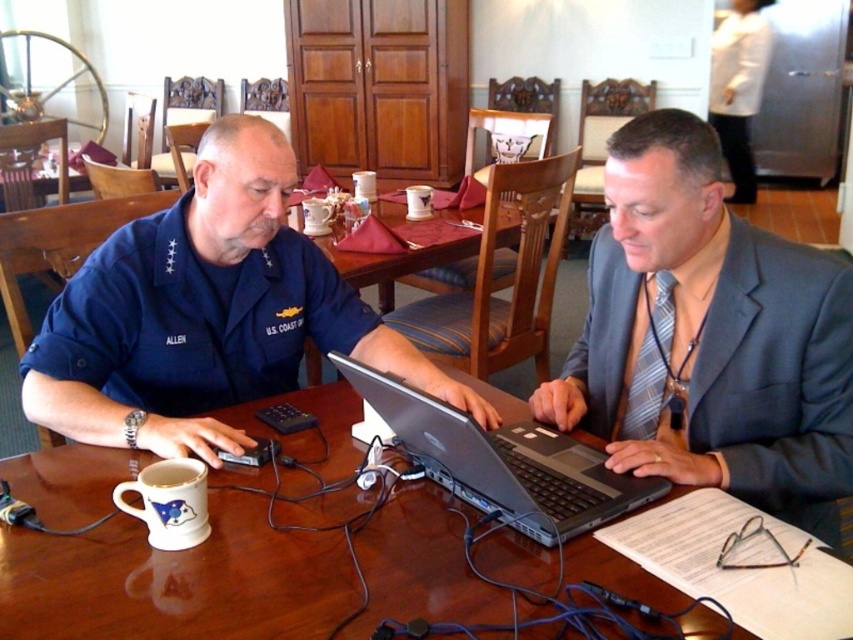
You are standing in the dining room and want to pick up the item at point (265, 506). If your arm can reach 3.5 feet, will you be able to reach it?

The point (265, 506) is 3.79 feet away from the viewer. Since your arm can only reach 3.5 feet, you will not be able to reach it.

You are standing in front of a dining table with a wooden surface. There is a point at coordinates point (3, 634). If you want to place a 12 inch long ruler on the table so that one end touches this point, where should the other end be placed to ensure the ruler is fully visible on the table?

The other end of the ruler should be placed 12 inches away from point (3, 634) in any direction that keeps the ruler entirely on the table surface.

You are a delivery robot that needs to place a package between the gray suit at center and the wooden table at center. The package requires 1 meter of space. Is there enough space between them?

The gray suit at center and wooden table at center are 1.12 meters apart from each other, so yes, the package can be placed between them as there is sufficient space exceeding the required 1 meter.